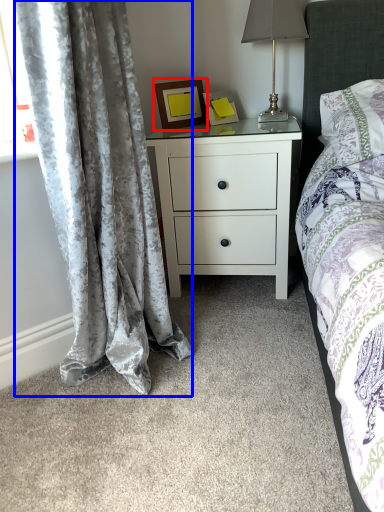
Question: Which point is further to the camera, picture frame (highlighted by a red box) or curtain (highlighted by a blue box)?

Choices:
 (A) picture frame
 (B) curtain

Answer: (A)